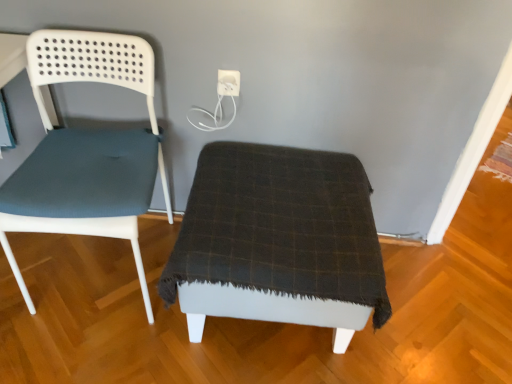
Question: In terms of width, does matte blue fabric chair at left look wider or thinner when compared to dark plaid fabric ottoman at center?

Choices:
 (A) wide
 (B) thin

Answer: (B)

Question: Considering the positions of matte blue fabric chair at left and dark plaid fabric ottoman at center in the image, is matte blue fabric chair at left bigger or smaller than dark plaid fabric ottoman at center?

Choices:
 (A) big
 (B) small

Answer: (B)

Question: Based on their relative distances, which object is farther from the matte blue fabric chair at left?

Choices:
 (A) white plastic electric outlet at upper center
 (B) dark plaid fabric ottoman at center

Answer: (A)

Question: Which is nearer to the white plastic electric outlet at upper center?

Choices:
 (A) matte blue fabric chair at left
 (B) dark plaid fabric ottoman at center

Answer: (A)